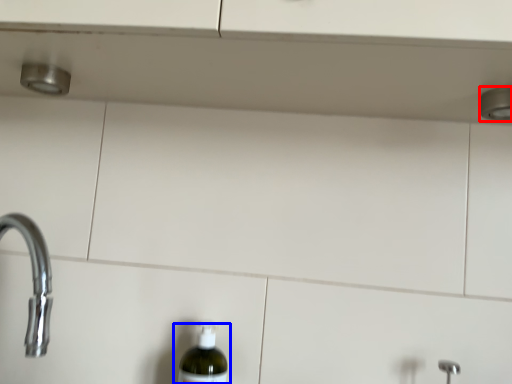
Question: Among these objects, which one is farthest to the camera, shower (highlighted by a red box) or bottle (highlighted by a blue box)?

Choices:
 (A) shower
 (B) bottle

Answer: (B)